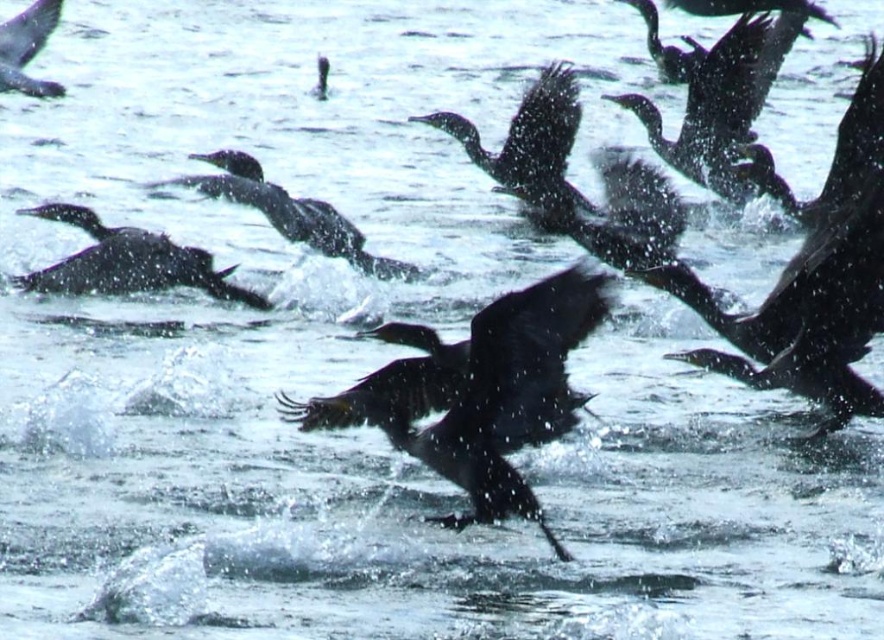
You are a birdwatcher observing the scene. You notice two shiny black birds in the image. Which of the two birds, the shiny black bird at left or the shiny black bird at upper left, is positioned more to the right side of the image?

The shiny black bird at left is positioned more to the right side of the image compared to the shiny black bird at upper left.

Consider the image. You are observing birds flying over water and notice two points in the scene. The first point is at coordinates point (408,445) and the second is at point (27,77). Which point is closer to you?

Point (408,445) is in front of point (27,77), so it is closer to you.

You are a wildlife photographer trying to capture a photo of the shiny black bird at center and the shiny black bird at left. Your camera can focus on objects within a 5 meter range. Can you get both birds in focus at the same time?

The shiny black bird at center is 4.55 meters from the shiny black bird at left. Since the distance between them is within the 5 meter range of your camera, you can get both birds in focus at the same time.